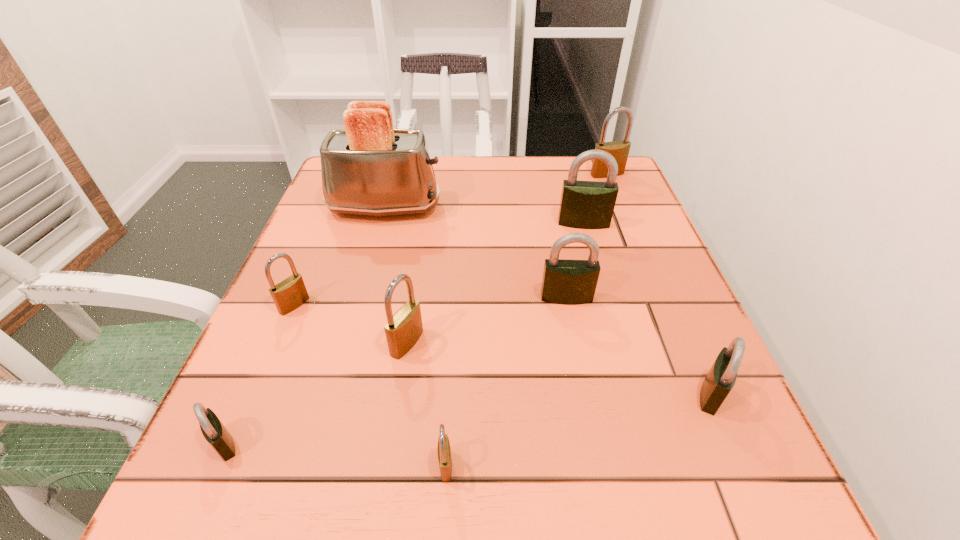
Image resolution: width=960 pixels, height=540 pixels. What are the coordinates of `the second smallest brass padlock` in the screenshot? It's located at (289, 294).

The width and height of the screenshot is (960, 540). Find the location of `the seventh farthest object`. the seventh farthest object is located at coordinates click(721, 378).

The height and width of the screenshot is (540, 960). I want to click on the third nearest padlock, so click(721, 378).

This screenshot has width=960, height=540. I want to click on the leftmost black padlock, so click(x=213, y=430).

Find the location of a particular element. the nearest black padlock is located at coordinates (213, 430).

This screenshot has height=540, width=960. Find the location of `the smallest brass padlock`. the smallest brass padlock is located at coordinates (444, 452).

Identify the location of the third brass padlock from left to right. (444, 452).

This screenshot has height=540, width=960. I want to click on vacant space located 0.120m on the side of the gray toaster with the control lever, so click(x=492, y=208).

The height and width of the screenshot is (540, 960). I want to click on vacant position located on the back of the second farthest padlock, so click(564, 158).

Locate an element on the screen. free space located 0.280m on the front of the biggest brass padlock is located at coordinates (636, 246).